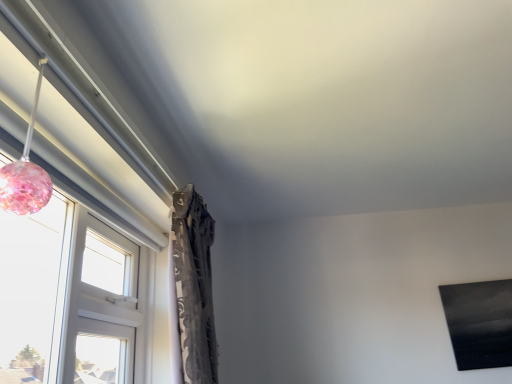
Image resolution: width=512 pixels, height=384 pixels. What are the coordinates of `transparent glass window at left` in the screenshot? It's located at (78, 226).

This screenshot has width=512, height=384. What do you see at coordinates (78, 226) in the screenshot?
I see `transparent glass window at left` at bounding box center [78, 226].

I want to click on translucent pink glass sphere at left, so click(26, 173).

Measure the distance between translucent pink glass sphere at left and camera.

30.81 inches.

Describe the element at coordinates (26, 173) in the screenshot. This screenshot has width=512, height=384. I see `translucent pink glass sphere at left` at that location.

Measure the distance between point (x=28, y=135) and camera.

The depth of point (x=28, y=135) is 36.42 inches.

Locate an element on the screen. The height and width of the screenshot is (384, 512). transparent glass window at left is located at coordinates (78, 226).

Which object is positioned more to the right, transparent glass window at left or translucent pink glass sphere at left?

From the viewer's perspective, transparent glass window at left appears more on the right side.

Is the depth of transparent glass window at left greater than that of translucent pink glass sphere at left?

Yes, the depth of transparent glass window at left is greater than that of translucent pink glass sphere at left.

Which is in front, point (71, 114) or point (48, 176)?

Point (48, 176)

From the image's perspective, between transparent glass window at left and translucent pink glass sphere at left, who is located below?

From the image's view, transparent glass window at left is below.

From a real-world perspective, between transparent glass window at left and translucent pink glass sphere at left, who is vertically higher?

From a 3D spatial view, transparent glass window at left is above.

Looking at their sizes, would you say transparent glass window at left is wider or thinner than translucent pink glass sphere at left?

Clearly, transparent glass window at left has less width compared to translucent pink glass sphere at left.

Considering the sizes of objects transparent glass window at left and translucent pink glass sphere at left in the image provided, who is shorter, transparent glass window at left or translucent pink glass sphere at left?

transparent glass window at left.

Is transparent glass window at left smaller than translucent pink glass sphere at left?

No.

Is transparent glass window at left situated inside translucent pink glass sphere at left or outside?

transparent glass window at left exists outside the volume of translucent pink glass sphere at left.

Is transparent glass window at left far away from translucent pink glass sphere at left?

No.

Is transparent glass window at left turned away from translucent pink glass sphere at left?

No, transparent glass window at left is not facing away from translucent pink glass sphere at left.

How many degrees apart are the facing directions of transparent glass window at left and translucent pink glass sphere at left?

transparent glass window at left and translucent pink glass sphere at left are facing 0.466 degrees away from each other.

Identify the location of window below the translucent pink glass sphere at left (from the image's perspective). (78, 226).

Can you confirm if translucent pink glass sphere at left is positioned to the right of transparent glass window at left?

No, translucent pink glass sphere at left is not to the right of transparent glass window at left.

Is translucent pink glass sphere at left closer to the viewer compared to transparent glass window at left?

Yes.

Considering the positions of point (37, 196) and point (3, 19), is point (37, 196) closer or farther from the camera than point (3, 19)?

Clearly, point (37, 196) is more distant from the camera than point (3, 19).

From the image's perspective, is translucent pink glass sphere at left located above or below transparent glass window at left?

translucent pink glass sphere at left is situated higher than transparent glass window at left in the image.

From a real-world perspective, does translucent pink glass sphere at left sit lower than transparent glass window at left?

Yes, from a real-world perspective, translucent pink glass sphere at left is under transparent glass window at left.

Considering the sizes of objects translucent pink glass sphere at left and transparent glass window at left in the image provided, who is thinner, translucent pink glass sphere at left or transparent glass window at left?

With smaller width is transparent glass window at left.

In terms of height, does translucent pink glass sphere at left look taller or shorter compared to transparent glass window at left?

Clearly, translucent pink glass sphere at left is taller compared to transparent glass window at left.

In terms of size, does translucent pink glass sphere at left appear bigger or smaller than transparent glass window at left?

In the image, translucent pink glass sphere at left appears to be smaller than transparent glass window at left.

Would you say transparent glass window at left is part of translucent pink glass sphere at left's contents?

That's incorrect, transparent glass window at left is not inside translucent pink glass sphere at left.

Are translucent pink glass sphere at left and transparent glass window at left far apart?

They are positioned close to each other.

Could you tell me if translucent pink glass sphere at left is facing transparent glass window at left?

No.

At what (x,y) coordinates should I click in order to perform the action: click on window behind the translucent pink glass sphere at left. Please return your answer as a coordinate pair (x, y). Image resolution: width=512 pixels, height=384 pixels. Looking at the image, I should click on (78, 226).

At what (x,y) coordinates should I click in order to perform the action: click on window above the translucent pink glass sphere at left (from a real-world perspective). Please return your answer as a coordinate pair (x, y). This screenshot has width=512, height=384. Looking at the image, I should click on pos(78,226).

At what (x,y) coordinates should I click in order to perform the action: click on lamp above the transparent glass window at left (from the image's perspective). Please return your answer as a coordinate pair (x, y). Looking at the image, I should click on (26, 173).